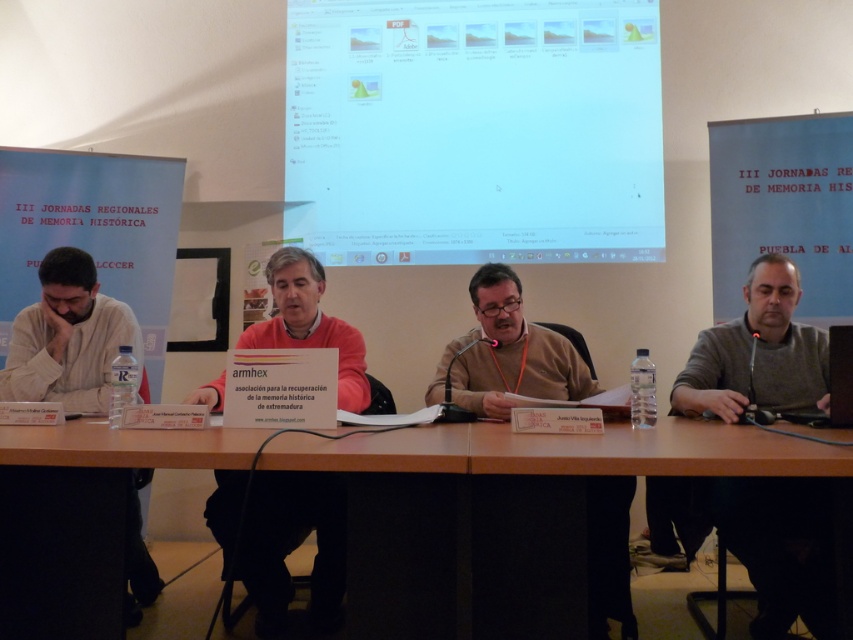
You are an attendee at this conference. You notice the pink fabric shirt at center and the white paper at upper center. Which object is located higher up in the image?

The white paper at upper center is higher up in the image than the pink fabric shirt at center.

You are an attendee at the conference and want to ask a question to the presenter wearing the pink fabric shirt at center. However, you need to pass the white paper at upper center first. Can you reach the presenter before the white paper?

The pink fabric shirt at center is to the left of the white paper at upper center, meaning the white paper is positioned further to the right. Since you need to pass the white paper first to reach the presenter, you will encounter the white paper before the presenter. Therefore, you can reach the presenter after passing the white paper at upper center.

You are an event organizer and need to ensure that all materials fit on the table. Given the pink fabric shirt at center and the white paper at upper center, which item takes up more space on the table?

The pink fabric shirt at center is bigger than the white paper at upper center, so it takes up more space on the table.